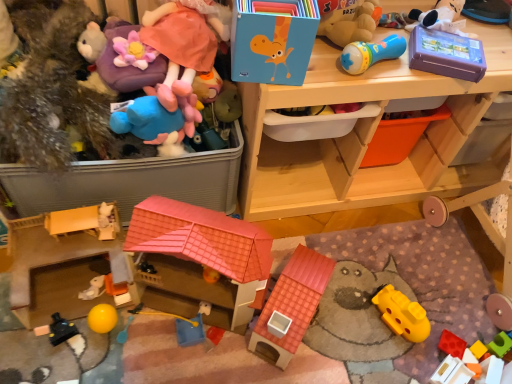
Find the location of a particular element. The image size is (512, 384). vacant space to the left of black plastic toy at lower left, the 13th toy viewed from the right is located at coordinates (26, 327).